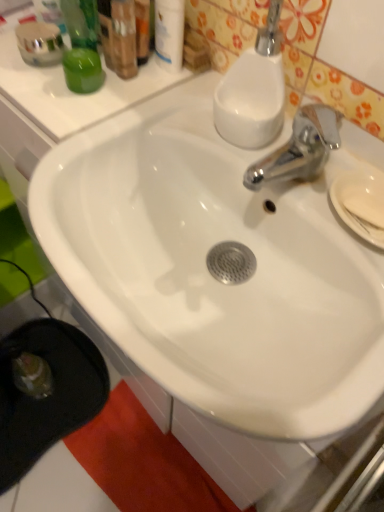
Identify the location of free point above red cotton beach towel at lower left (from a real-world perspective). Image resolution: width=384 pixels, height=512 pixels. pyautogui.click(x=154, y=460).